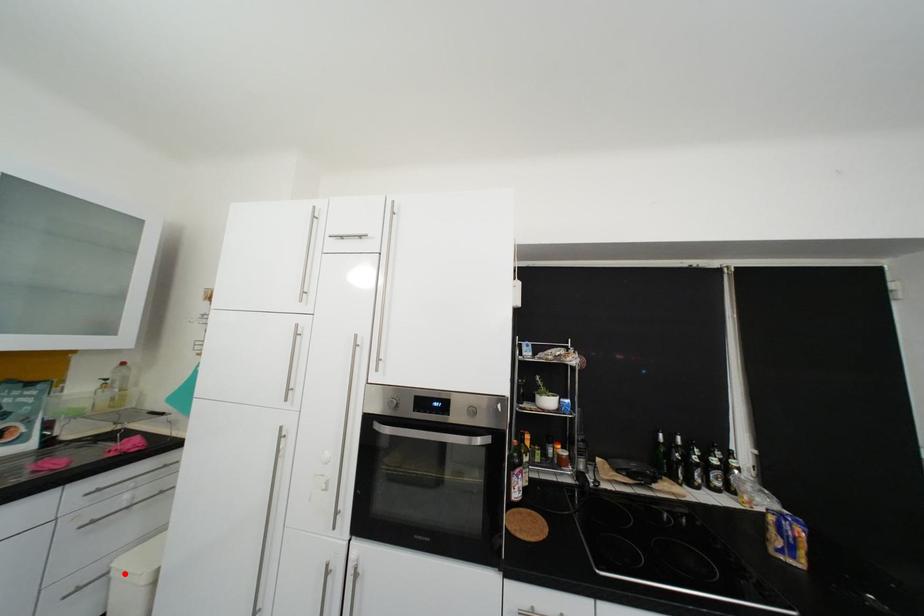
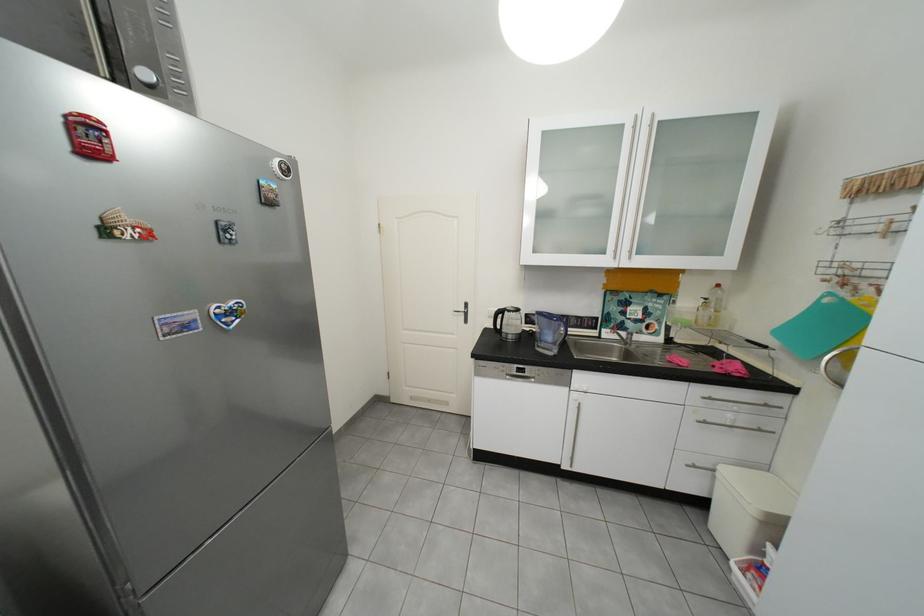
Question: I am providing you with two images of the same scene from different viewpoints. A red point is marked on the first image. At the location where the point appears in image 1, is it still visible in image 2?

Choices:
 (A) Yes
 (B) No

Answer: (A)